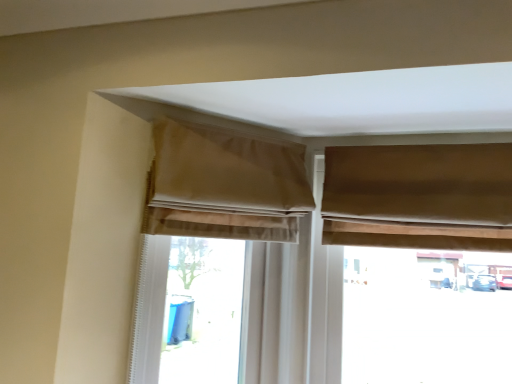
Question: In terms of size, does matte brown curtain at upper right, marked as the first curtain in a right-to-left arrangement, appear bigger or smaller than beige fabric window at upper center?

Choices:
 (A) big
 (B) small

Answer: (B)

Question: Which is correct: matte brown curtain at upper right, marked as the first curtain in a right-to-left arrangement, is inside beige fabric window at upper center, or outside of it?

Choices:
 (A) inside
 (B) outside

Answer: (B)

Question: Which is farther from the beige fabric curtain at upper left, the 1th curtain from the left?

Choices:
 (A) beige fabric window at upper center
 (B) beige fabric curtain at upper center, the second curtain in the left-to-right sequence
 (C) matte brown curtain at upper right, marked as the first curtain in a right-to-left arrangement

Answer: (C)

Question: Which is nearer to the beige fabric curtain at upper center, which is the 2th curtain from right to left?

Choices:
 (A) matte brown curtain at upper right, marked as the first curtain in a right-to-left arrangement
 (B) beige fabric curtain at upper left, the third curtain when ordered from right to left
 (C) beige fabric window at upper center

Answer: (B)